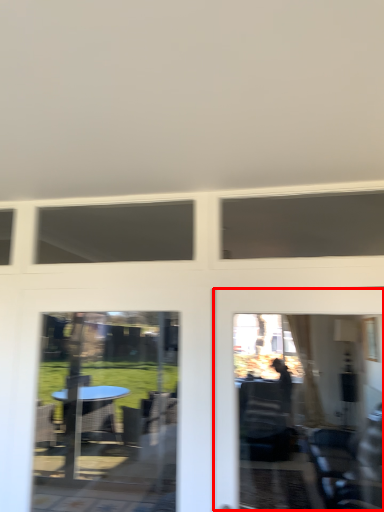
Question: From the image, what is the correct spatial relationship of garage door (annotated by the red box) in relation to screen door?

Choices:
 (A) left
 (B) right

Answer: (B)